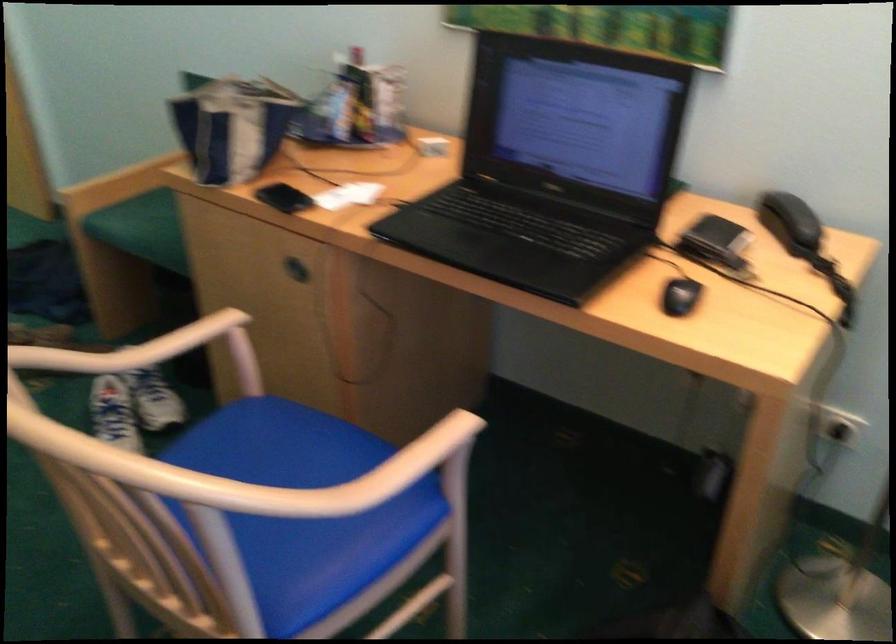
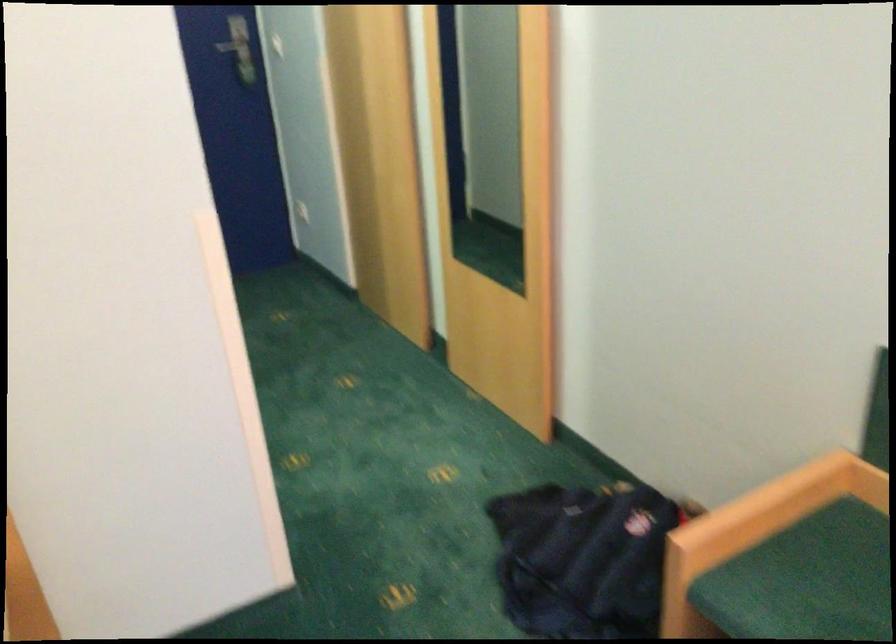
The images are taken continuously from a first-person perspective. In which direction are you moving?

The cameraman walked toward left, forward.